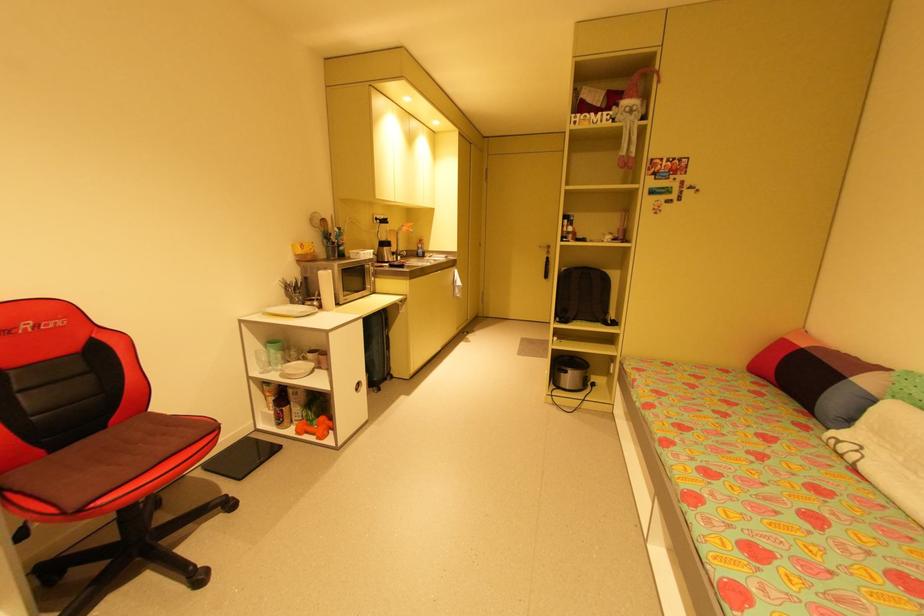
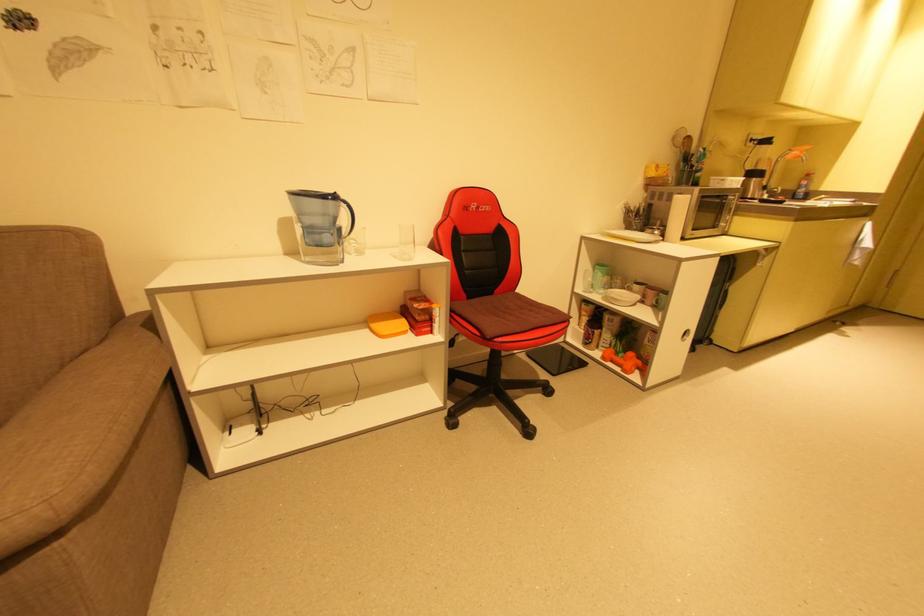
Find the pixel in the second image that matches (335,434) in the first image.

(641, 371)